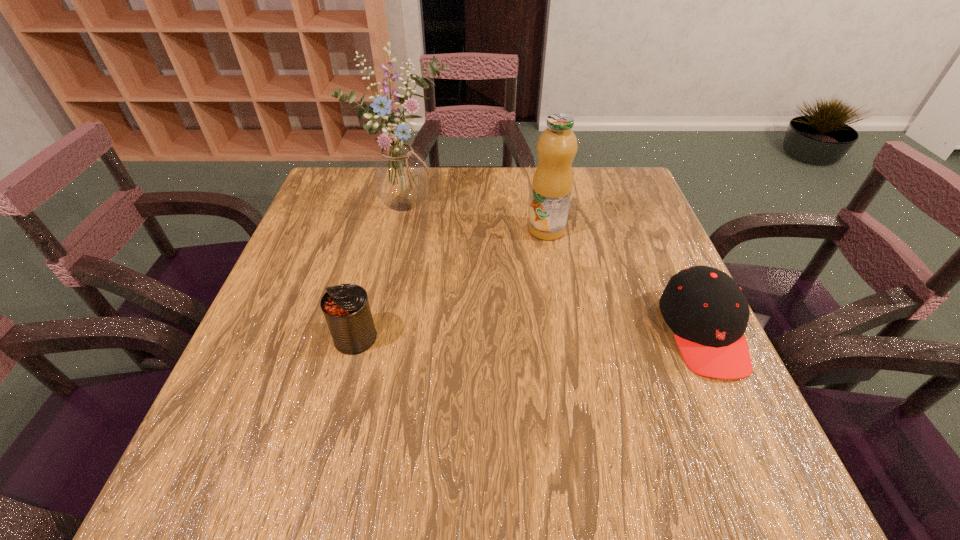
Locate an element on the screen. The width and height of the screenshot is (960, 540). empty space that is in between the cap and the fruit juice is located at coordinates (625, 281).

Identify the location of vacant space that is in between the shortest object and the third tallest object. point(529,335).

Where is `blank region between the third tallest object and the rightmost object`? The width and height of the screenshot is (960, 540). blank region between the third tallest object and the rightmost object is located at coordinates (529, 335).

At what (x,y) coordinates should I click in order to perform the action: click on vacant space in between the can and the cap. Please return your answer as a coordinate pair (x, y). Looking at the image, I should click on (529, 335).

This screenshot has width=960, height=540. I want to click on vacant space in between the shortest object and the fruit juice, so click(x=625, y=281).

Identify which object is the second closest to the second shortest object. Please provide its 2D coordinates. Your answer should be formatted as a tuple, i.e. [(x, y)], where the tuple contains the x and y coordinates of a point satisfying the conditions above.

[(557, 146)]

Find the location of a particular element. the second closest object to the second tallest object is located at coordinates (707, 311).

The height and width of the screenshot is (540, 960). Find the location of `vacant area in the image that satisfies the following two spatial constraints: 1. on the front side of the bouquet; 2. on the left side of the fruit juice`. vacant area in the image that satisfies the following two spatial constraints: 1. on the front side of the bouquet; 2. on the left side of the fruit juice is located at coordinates (401, 230).

Where is `free space that satisfies the following two spatial constraints: 1. on the back side of the second object from right to left; 2. on the left side of the second shortest object`? free space that satisfies the following two spatial constraints: 1. on the back side of the second object from right to left; 2. on the left side of the second shortest object is located at coordinates (383, 230).